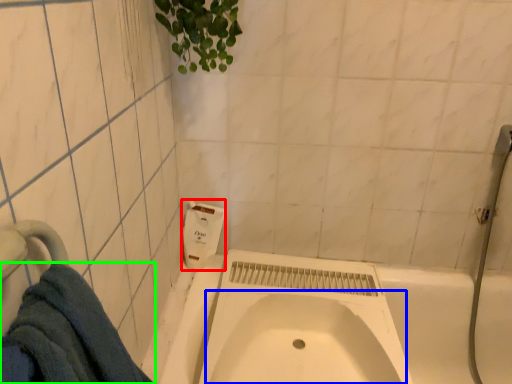
Question: Which object is the farthest from soap dispenser (highlighted by a red box)? Choose among these: sink (highlighted by a blue box) or towel (highlighted by a green box).

Choices:
 (A) sink
 (B) towel

Answer: (B)